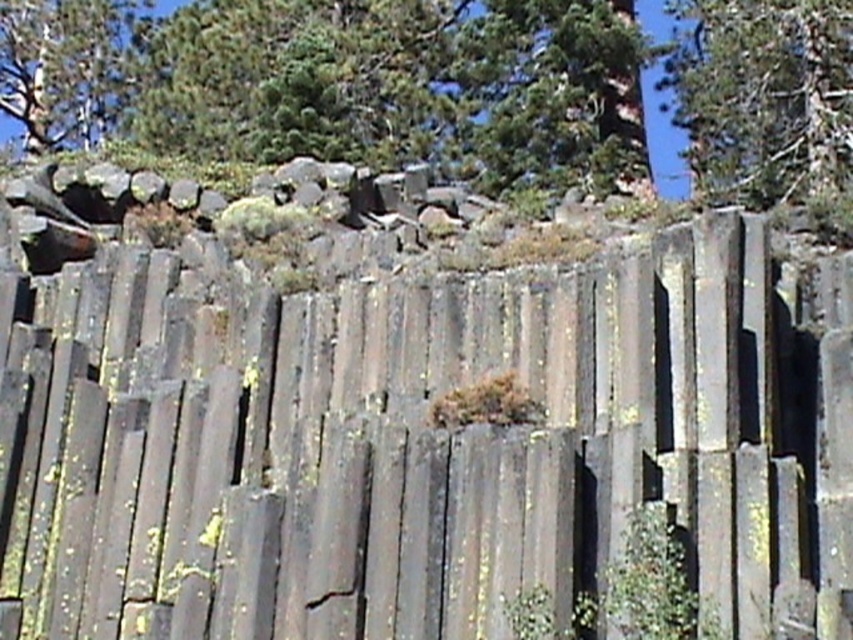
Question: Which object is the farthest from the gray stone columns at center?

Choices:
 (A) green textured tree at upper left
 (B) green leafy tree at upper center
 (C) green leafy tree at upper right

Answer: (A)

Question: Does green leafy tree at upper center appear on the right side of green textured tree at upper left?

Choices:
 (A) yes
 (B) no

Answer: (A)

Question: Which object appears closest to the camera in this image?

Choices:
 (A) green leafy tree at upper center
 (B) gray stone columns at center
 (C) green leafy tree at upper right

Answer: (B)

Question: Is gray stone columns at center above green leafy tree at upper center?

Choices:
 (A) no
 (B) yes

Answer: (A)

Question: Does green leafy tree at upper right have a lesser width compared to green leafy tree at upper center?

Choices:
 (A) no
 (B) yes

Answer: (A)

Question: Which object is farther from the camera taking this photo?

Choices:
 (A) green leafy tree at upper right
 (B) green leafy tree at upper center
 (C) gray stone columns at center
 (D) green textured tree at upper left

Answer: (D)